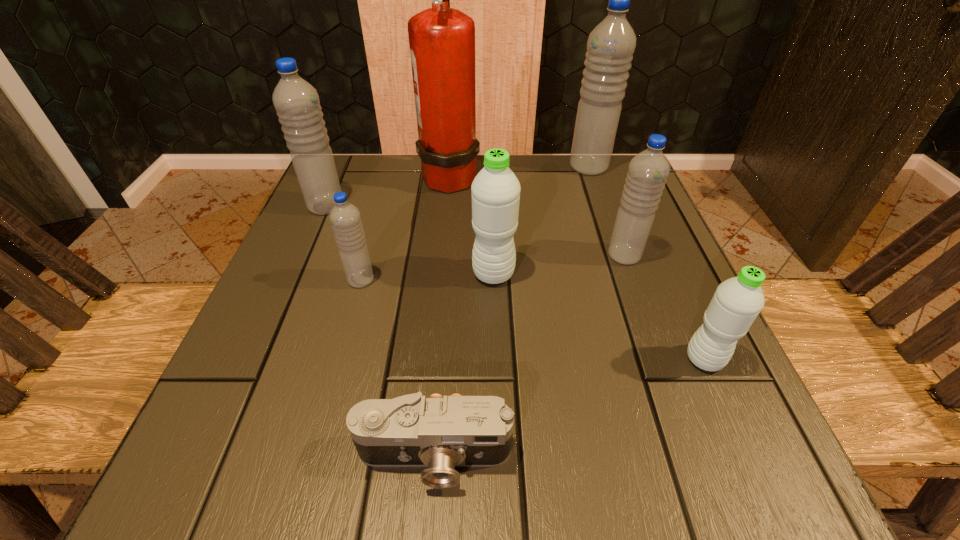
Locate an element on the screen. Image resolution: width=960 pixels, height=540 pixels. red fire extinguisher is located at coordinates (442, 40).

Identify the location of fire extinguisher. This screenshot has width=960, height=540. (442, 40).

Find the location of a particular element. The width and height of the screenshot is (960, 540). the biggest blue water bottle is located at coordinates (610, 47).

At what (x,y) coordinates should I click in order to perform the action: click on the second tallest object. Please return your answer as a coordinate pair (x, y). The image size is (960, 540). Looking at the image, I should click on (610, 47).

I want to click on the third smallest blue water bottle, so click(296, 101).

Locate an element on the screen. The image size is (960, 540). the fifth nearest water bottle is located at coordinates click(x=296, y=101).

You are a GUI agent. You are given a task and a screenshot of the screen. Output one action in this format:
    pyautogui.click(x=<x>, y=<y>)
    Task: Click on the third water bottle from left to right
    This screenshot has width=960, height=540.
    Given the screenshot: What is the action you would take?
    pyautogui.click(x=495, y=190)

Locate an element on the screen. the farther green water bottle is located at coordinates (495, 190).

You are a GUI agent. You are given a task and a screenshot of the screen. Output one action in this format:
    pyautogui.click(x=<x>, y=<y>)
    Task: Click on the second nearest blue water bottle
    The image size is (960, 540).
    Given the screenshot: What is the action you would take?
    pyautogui.click(x=648, y=171)

Where is `the third blue water bottle from right to left`? The image size is (960, 540). the third blue water bottle from right to left is located at coordinates (345, 218).